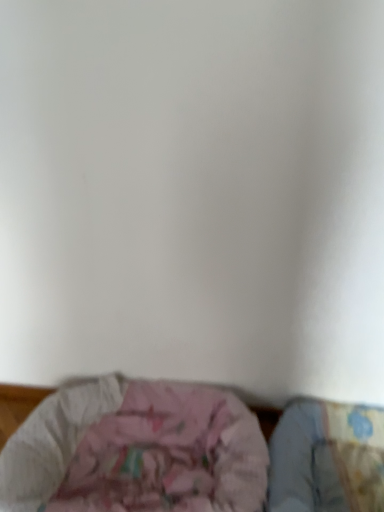
Question: Which is correct: pink fabric cushion at lower center is inside fluffy cotton sheet at lower right, or outside of it?

Choices:
 (A) outside
 (B) inside

Answer: (A)

Question: From the image's perspective, relative to fluffy cotton sheet at lower right, is pink fabric cushion at lower center above or below?

Choices:
 (A) below
 (B) above

Answer: (B)

Question: From a real-world perspective, is pink fabric cushion at lower center positioned above or below fluffy cotton sheet at lower right?

Choices:
 (A) above
 (B) below

Answer: (A)

Question: In terms of size, does fluffy cotton sheet at lower right appear bigger or smaller than pink fabric cushion at lower center?

Choices:
 (A) small
 (B) big

Answer: (A)

Question: Considering their positions, is fluffy cotton sheet at lower right located in front of or behind pink fabric cushion at lower center?

Choices:
 (A) front
 (B) behind

Answer: (B)

Question: From the image's perspective, is fluffy cotton sheet at lower right above or below pink fabric cushion at lower center?

Choices:
 (A) above
 (B) below

Answer: (B)

Question: Is fluffy cotton sheet at lower right wider or thinner than pink fabric cushion at lower center?

Choices:
 (A) wide
 (B) thin

Answer: (B)